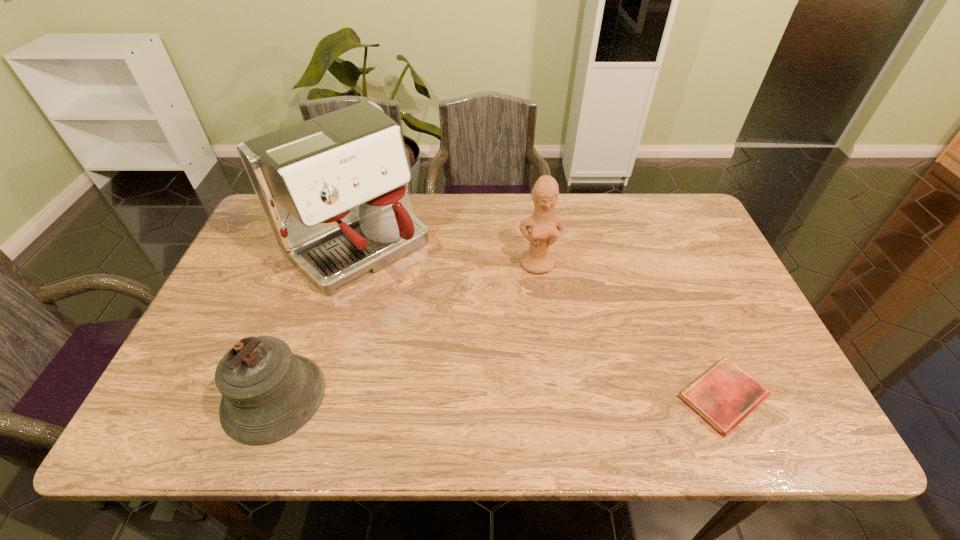
In order to click on vacant spot on the desktop that is between the third tallest object and the rightmost object and is positioned on the front of the tallest object near the spout in this screenshot , I will do `click(512, 396)`.

Where is `vacant space on the desktop that is between the bell and the diary and is positioned on the front-facing side of the figurine`? This screenshot has height=540, width=960. vacant space on the desktop that is between the bell and the diary and is positioned on the front-facing side of the figurine is located at coordinates pyautogui.click(x=564, y=396).